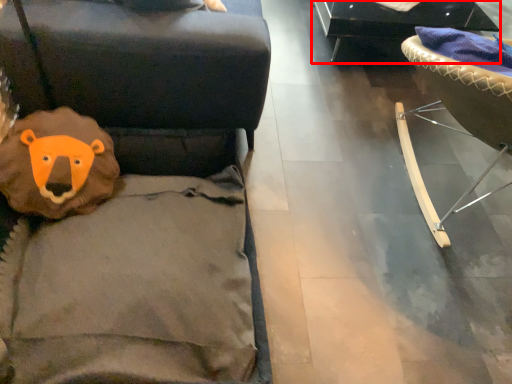
Question: From the image's perspective, what is the correct spatial relationship of furniture (annotated by the red box) in relation to furniture?

Choices:
 (A) above
 (B) below

Answer: (A)